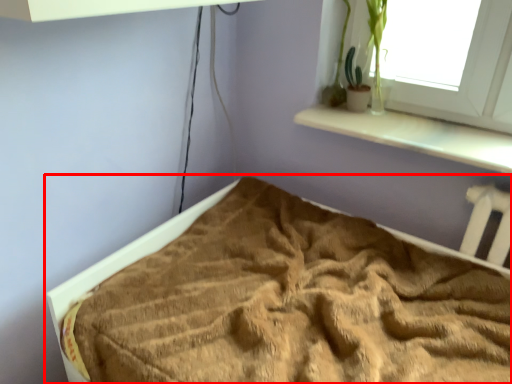
Question: From the image's perspective, what is the correct spatial relationship of bed (annotated by the red box) in relation to plant?

Choices:
 (A) above
 (B) below

Answer: (B)